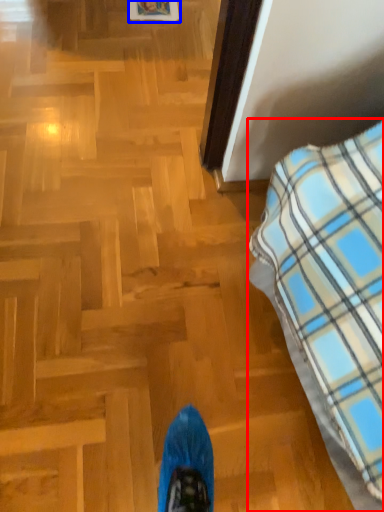
Question: Which object is closer to the camera taking this photo, furniture (highlighted by a red box) or picture frame (highlighted by a blue box)?

Choices:
 (A) furniture
 (B) picture frame

Answer: (A)